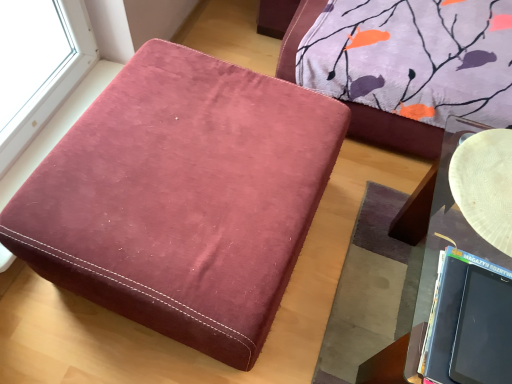
Question: Is white textured plate at right outside matte black laptop at lower right?

Choices:
 (A) yes
 (B) no

Answer: (A)

Question: Is white textured plate at right taller than matte black laptop at lower right?

Choices:
 (A) yes
 (B) no

Answer: (B)

Question: Are white textured plate at right and matte black laptop at lower right far apart?

Choices:
 (A) yes
 (B) no

Answer: (B)

Question: Is white textured plate at right facing away from matte black laptop at lower right?

Choices:
 (A) no
 (B) yes

Answer: (A)

Question: Is white textured plate at right shorter than matte black laptop at lower right?

Choices:
 (A) yes
 (B) no

Answer: (A)

Question: Could you tell me if white textured plate at right is turned towards matte black laptop at lower right?

Choices:
 (A) yes
 (B) no

Answer: (A)

Question: Are matte black laptop at lower right and velvet-like burgundy ottoman at center located far from each other?

Choices:
 (A) no
 (B) yes

Answer: (A)

Question: Is matte black laptop at lower right oriented away from velvet-like burgundy ottoman at center?

Choices:
 (A) yes
 (B) no

Answer: (B)

Question: Does matte black laptop at lower right lie behind velvet-like burgundy ottoman at center?

Choices:
 (A) no
 (B) yes

Answer: (A)

Question: From a real-world perspective, does matte black laptop at lower right sit lower than velvet-like burgundy ottoman at center?

Choices:
 (A) yes
 (B) no

Answer: (B)

Question: Can you confirm if matte black laptop at lower right is positioned to the right of velvet-like burgundy ottoman at center?

Choices:
 (A) no
 (B) yes

Answer: (B)

Question: Considering the relative sizes of matte black laptop at lower right and velvet-like burgundy ottoman at center in the image provided, is matte black laptop at lower right wider than velvet-like burgundy ottoman at center?

Choices:
 (A) yes
 (B) no

Answer: (B)

Question: Can you confirm if velvet-like burgundy ottoman at center is thinner than matte black laptop at lower right?

Choices:
 (A) no
 (B) yes

Answer: (A)